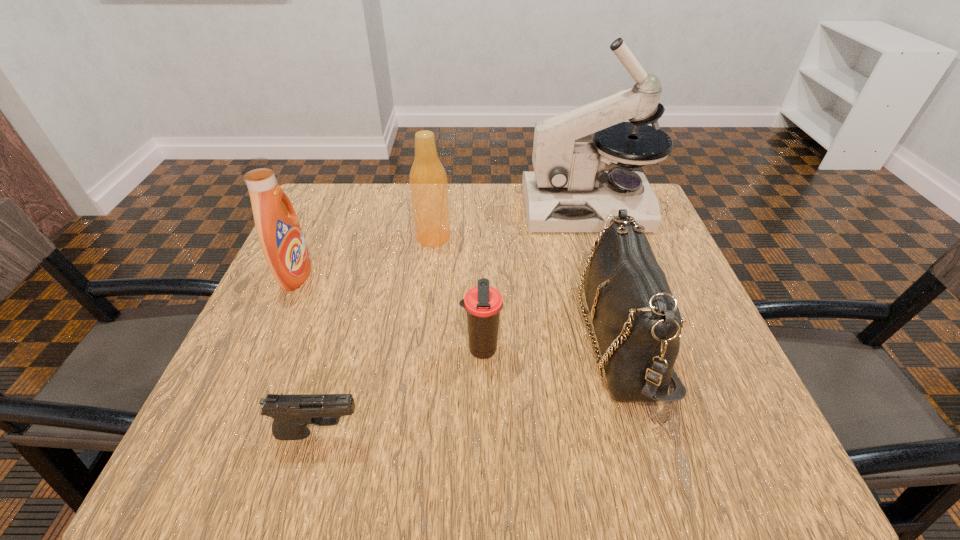
Where is `the tallest object`? This screenshot has width=960, height=540. the tallest object is located at coordinates (568, 191).

Where is `the leftmost object`? the leftmost object is located at coordinates (278, 229).

Locate an element on the screen. the third object from left to right is located at coordinates (428, 182).

Where is `handbag`? The height and width of the screenshot is (540, 960). handbag is located at coordinates (636, 319).

You are a GUI agent. You are given a task and a screenshot of the screen. Output one action in this format:
    pyautogui.click(x=<x>, y=<y>)
    Task: Click on the fourth object from left to right
    The height and width of the screenshot is (540, 960).
    Given the screenshot: What is the action you would take?
    pyautogui.click(x=483, y=303)

Locate an element on the screen. The width and height of the screenshot is (960, 540). thermos bottle is located at coordinates (483, 303).

Locate an element on the screen. The height and width of the screenshot is (540, 960). the shortest object is located at coordinates (292, 413).

Locate an element on the screen. the nearest object is located at coordinates (292, 413).

Locate an element on the screen. vacant space located 0.110m at the eyepiece of the tallest object is located at coordinates (484, 207).

The height and width of the screenshot is (540, 960). What are the coordinates of `vacant space located 0.180m at the eyepiece of the tallest object` in the screenshot? It's located at [457, 207].